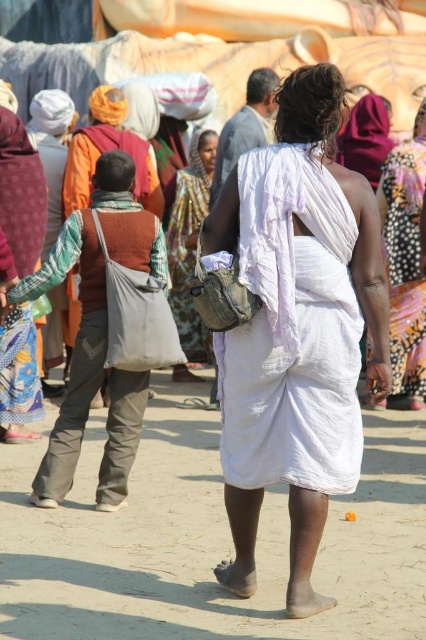
Question: Estimate the real-world distances between objects in this image. Which object is farther from the dirt field at lower center?

Choices:
 (A) textured fabric sari at center
 (B) white cotton sari at center
 (C) white cotton dhoti at center
 (D) brown fabric bag at left

Answer: (A)

Question: Is the position of white cotton sari at center more distant than that of brown fabric bag at left?

Choices:
 (A) yes
 (B) no

Answer: (B)

Question: Does white cotton sari at center have a smaller size compared to white cotton dhoti at center?

Choices:
 (A) no
 (B) yes

Answer: (A)

Question: Among these points, which one is farthest from the camera?

Choices:
 (A) (359, 618)
 (B) (221, 572)

Answer: (B)

Question: Which object appears farthest from the camera in this image?

Choices:
 (A) white cotton sari at center
 (B) white cotton dhoti at center
 (C) white cloth at center
 (D) textured fabric sari at center

Answer: (D)

Question: Does dirt field at lower center appear on the right side of white cloth at center?

Choices:
 (A) no
 (B) yes

Answer: (A)